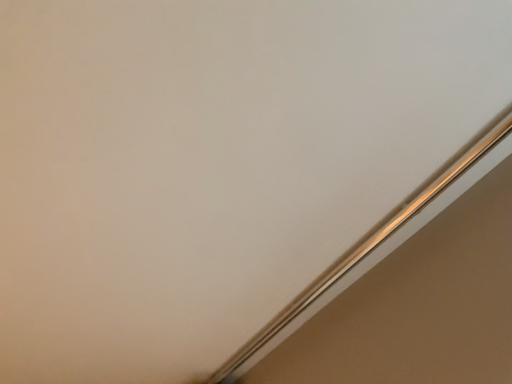
At what (x,y) coordinates should I click in order to perform the action: click on metallic silver at upper right. Please return your answer as a coordinate pair (x, y). The width and height of the screenshot is (512, 384). Looking at the image, I should click on (374, 248).

The height and width of the screenshot is (384, 512). What do you see at coordinates (374, 248) in the screenshot? I see `metallic silver at upper right` at bounding box center [374, 248].

Locate an element on the screen. The width and height of the screenshot is (512, 384). metallic silver at upper right is located at coordinates (374, 248).